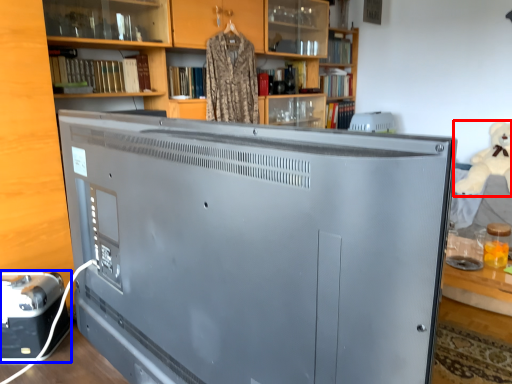
Question: Which object appears farthest to the camera in this image, toy (highlighted by a red box) or appliance (highlighted by a blue box)?

Choices:
 (A) toy
 (B) appliance

Answer: (A)